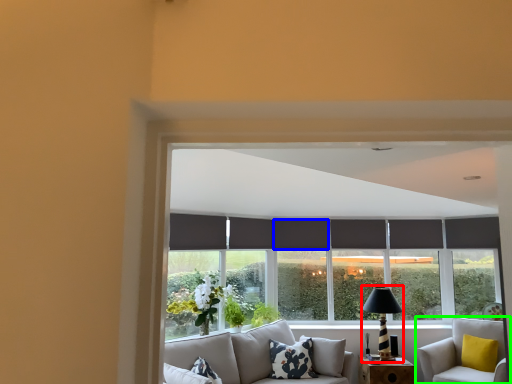
Question: Estimate the real-world distances between objects in this image. Which object is farther from table lamp (highlighted by a red box), curtain (highlighted by a blue box) or studio couch (highlighted by a green box)?

Choices:
 (A) curtain
 (B) studio couch

Answer: (A)